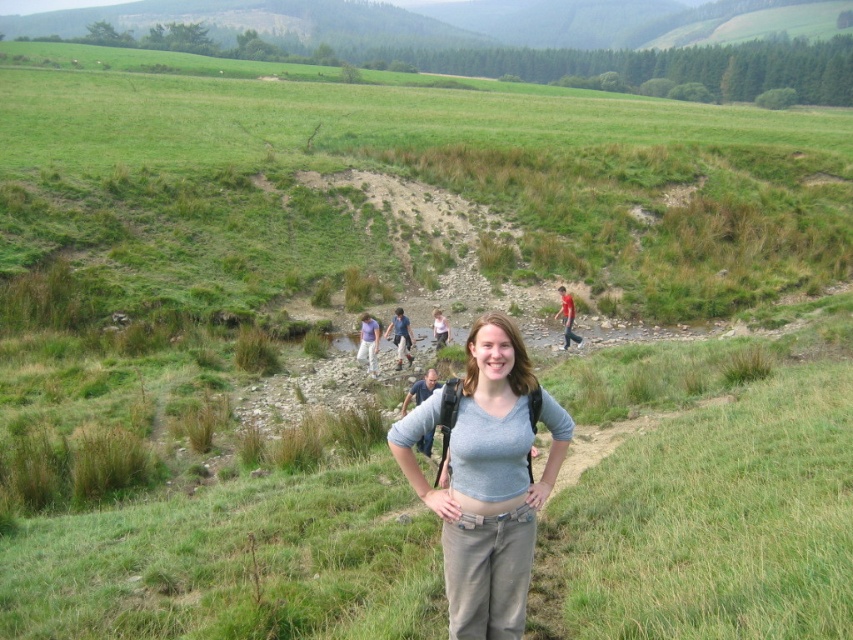
Does gray fabric backpack at center appear on the right side of red shirt at center?

Incorrect, gray fabric backpack at center is not on the right side of red shirt at center.

In order to click on gray fabric backpack at center in this screenshot , I will do `click(421, 388)`.

Is point (422, 452) in front of point (438, 348)?

Yes, point (422, 452) is closer to viewer.

Is gray fabric backpack at center bigger than light pink fabric shirt at center?

Correct, gray fabric backpack at center is larger in size than light pink fabric shirt at center.

Where is `gray fabric backpack at center`? The width and height of the screenshot is (853, 640). gray fabric backpack at center is located at coordinates (421, 388).

Does matte blue shirt at center come in front of red shirt at center?

Yes.

Does matte blue shirt at center appear over red shirt at center?

No.

Describe the element at coordinates (368, 342) in the screenshot. This screenshot has height=640, width=853. I see `matte blue shirt at center` at that location.

The width and height of the screenshot is (853, 640). I want to click on matte blue shirt at center, so click(368, 342).